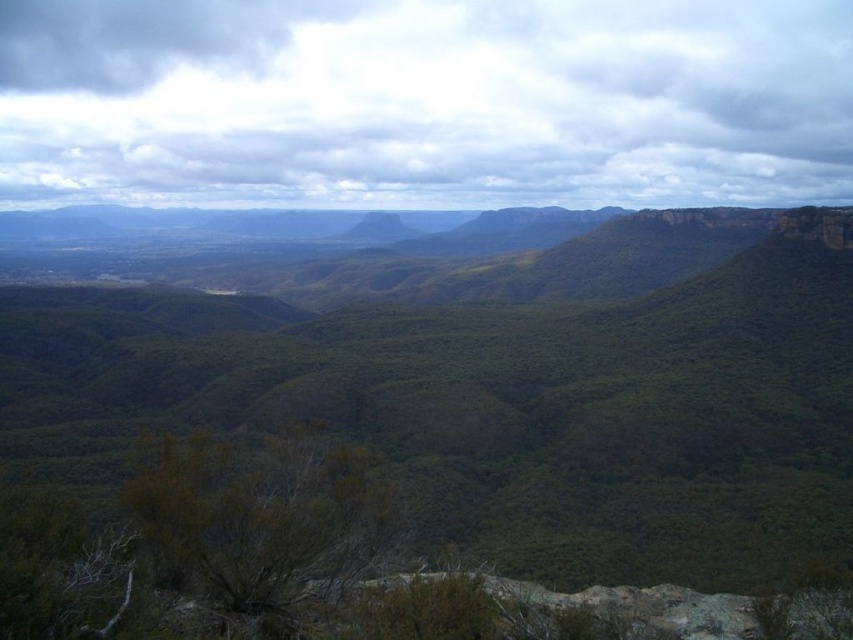
Is point (169, 106) positioned behind point (367, 234)?

Yes, it is.

Does cloudy sky at upper center have a lesser height compared to green grassy peak at center?

Incorrect, cloudy sky at upper center's height does not fall short of green grassy peak at center's.

Does point (289, 173) lie behind point (390, 211)?

Yes, point (289, 173) is behind point (390, 211).

Find the location of a particular element. The image size is (853, 640). cloudy sky at upper center is located at coordinates (424, 102).